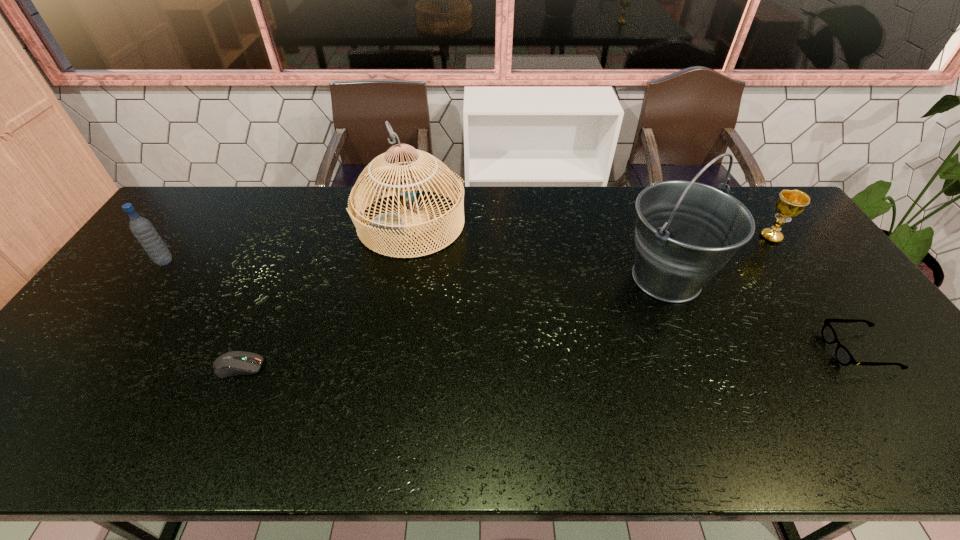
Find the location of a particular element. Image resolution: width=960 pixels, height=540 pixels. free space between the spectacles and the bucket is located at coordinates (762, 314).

Locate an element on the screen. The height and width of the screenshot is (540, 960). vacant area that lies between the fourth shortest object and the third object from left to right is located at coordinates (288, 242).

Image resolution: width=960 pixels, height=540 pixels. Identify the location of free space between the spectacles and the chalice. (814, 294).

In order to click on free point between the fifth object from right to left and the leftmost object in this screenshot , I will do `click(202, 314)`.

Find the location of a particular element. The height and width of the screenshot is (540, 960). object that is the fifth closest to the fourth object from right to left is located at coordinates (843, 356).

Find the location of a particular element. object that is the third closest to the water bottle is located at coordinates (686, 231).

Where is `free location that satisfies the following two spatial constraints: 1. on the front side of the third shortest object; 2. on the right side of the fourth object from right to left`? The image size is (960, 540). free location that satisfies the following two spatial constraints: 1. on the front side of the third shortest object; 2. on the right side of the fourth object from right to left is located at coordinates (408, 238).